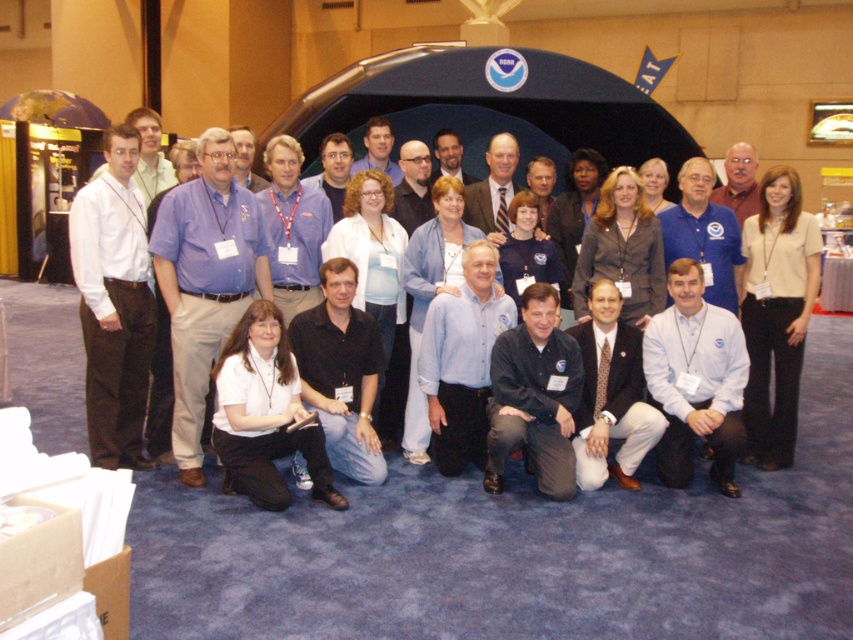
Is white cotton shirt at left taller than white shirt at center?

Yes, white cotton shirt at left is taller than white shirt at center.

Does white cotton shirt at left appear on the right side of white shirt at center?

In fact, white cotton shirt at left is to the left of white shirt at center.

Consider the image. Who is more distant from viewer, (x=132, y=465) or (x=306, y=196)?

The point (x=306, y=196) is behind.

The width and height of the screenshot is (853, 640). In order to click on white cotton shirt at left in this screenshot , I will do `click(114, 304)`.

Who is shorter, white fabric shirt at lower center or white cotton shirt at left?

With less height is white cotton shirt at left.

Can you confirm if white fabric shirt at lower center is positioned below white cotton shirt at left?

Indeed, white fabric shirt at lower center is positioned under white cotton shirt at left.

Find the location of a particular element. white fabric shirt at lower center is located at coordinates (206, 280).

Where is `white fabric shirt at lower center`? white fabric shirt at lower center is located at coordinates (206, 280).

Between beige fabric shirt at center and white shirt at center, which one appears on the right side from the viewer's perspective?

beige fabric shirt at center is more to the right.

Locate an element on the screen. Image resolution: width=853 pixels, height=640 pixels. beige fabric shirt at center is located at coordinates (776, 314).

The height and width of the screenshot is (640, 853). Find the location of `beige fabric shirt at center`. beige fabric shirt at center is located at coordinates (x=776, y=314).